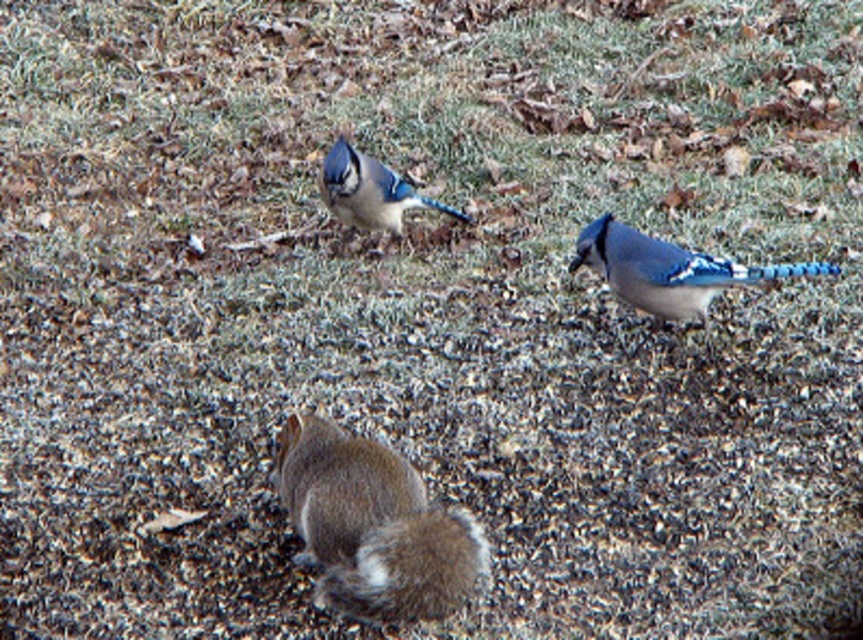
You are a photographer trying to capture both the blue glossy bird at upper right and the blue glossy bird at center in a single frame. Based on their positions, do you think they will fit within the camera lens without moving the camera? Please explain your reasoning.

The distance between the blue glossy bird at upper right and the blue glossy bird at center is 30.63 inches. If the camera lens can accommodate this distance within its field of view, then both birds can be captured in a single frame without moving the camera. However, if the lens has a narrower field of view, they might not fit.

You are a photographer trying to capture a closeup shot of the blue glossy bird at upper right. However, the fuzzy brown squirrel at center is blocking your view. Can you tell me which animal you need to move to get an unobstructed view of the bird?

The fuzzy brown squirrel at center is bigger than the blue glossy bird at upper right, so you need to move the fuzzy brown squirrel at center to get an unobstructed view of the blue glossy bird at upper right.